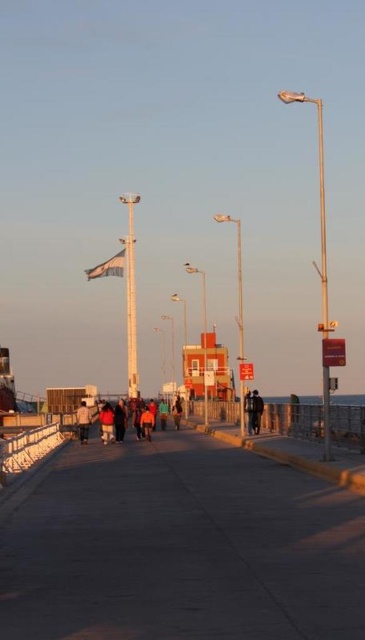
You are standing at the end of the walkway and want to pick up both the dark brown leather jacket at center and the denim jacket at center. Which jacket should you reach for first if you want to minimize the distance you walk?

The dark brown leather jacket at center is 8.62 feet away from the denim jacket at center. Since you want to minimize the distance walked, you should first pick up the jacket that is closer to your starting position. However, the exact distance from your position to each jacket isn